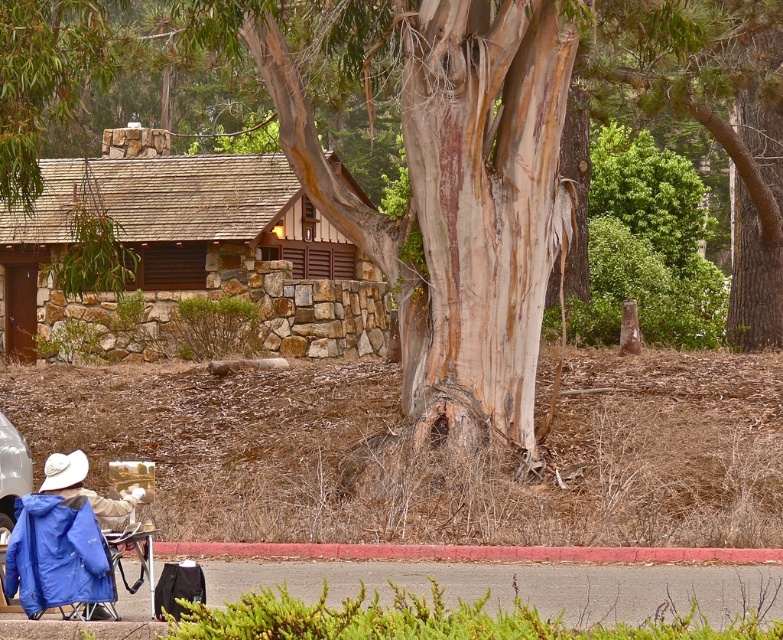
Does point (146, 294) come behind point (110, 564)?

Yes.

Which is more to the right, stone cabin at center or blue fabric jacket at lower left?

From the viewer's perspective, stone cabin at center appears more on the right side.

Is point (211, 177) more distant than point (65, 589)?

Yes.

At what (x,y) coordinates should I click in order to perform the action: click on stone cabin at center. Please return your answer as a coordinate pair (x, y). The width and height of the screenshot is (783, 640). Looking at the image, I should click on (193, 248).

Which of these two, stone cabin at center or white matte cowboy hat at lower left, stands taller?

With more height is stone cabin at center.

Describe the element at coordinates (193, 248) in the screenshot. The width and height of the screenshot is (783, 640). I see `stone cabin at center` at that location.

I want to click on stone cabin at center, so click(x=193, y=248).

Based on the photo, can you confirm if blue fabric jacket at lower left is shorter than white matte cowboy hat at lower left?

No.

Who is positioned more to the left, blue fabric jacket at lower left or white matte cowboy hat at lower left?

white matte cowboy hat at lower left is more to the left.

Who is more forward, (20, 536) or (53, 464)?

Point (20, 536) is more forward.

Where is `blue fabric jacket at lower left`? The image size is (783, 640). blue fabric jacket at lower left is located at coordinates (63, 541).